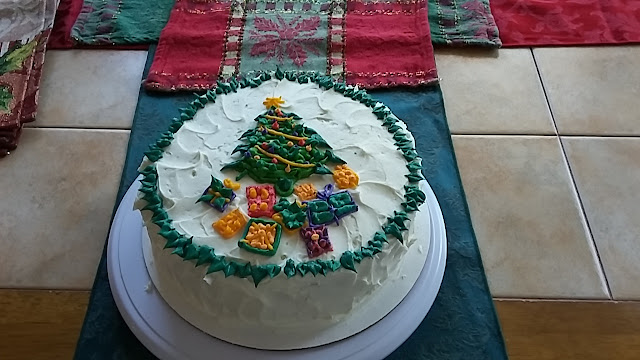
I want to click on christmas-themed, cloth placemat, so click(182, 60), click(233, 39), click(301, 28), click(348, 23), click(419, 17).